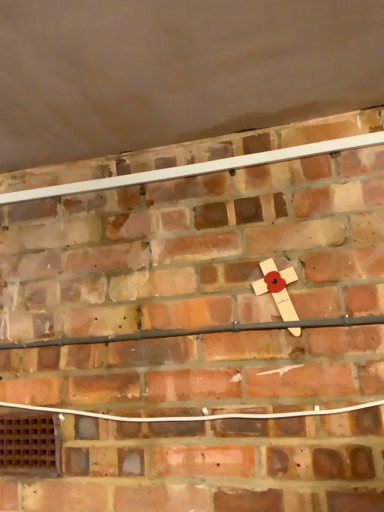
Question: In terms of size, does wooden cross at center appear bigger or smaller than brown wooden vent at lower left?

Choices:
 (A) big
 (B) small

Answer: (A)

Question: From a real-world perspective, is wooden cross at center above or below brown wooden vent at lower left?

Choices:
 (A) above
 (B) below

Answer: (A)

Question: From the image's perspective, is wooden cross at center positioned above or below brown wooden vent at lower left?

Choices:
 (A) below
 (B) above

Answer: (B)

Question: From the image's perspective, is brown wooden vent at lower left positioned above or below wooden cross at center?

Choices:
 (A) above
 (B) below

Answer: (B)

Question: Is brown wooden vent at lower left taller or shorter than wooden cross at center?

Choices:
 (A) short
 (B) tall

Answer: (A)

Question: Considering the positions of brown wooden vent at lower left and wooden cross at center in the image, is brown wooden vent at lower left wider or thinner than wooden cross at center?

Choices:
 (A) thin
 (B) wide

Answer: (A)

Question: Considering the relative positions of brown wooden vent at lower left and wooden cross at center in the image provided, is brown wooden vent at lower left to the left or to the right of wooden cross at center?

Choices:
 (A) left
 (B) right

Answer: (A)